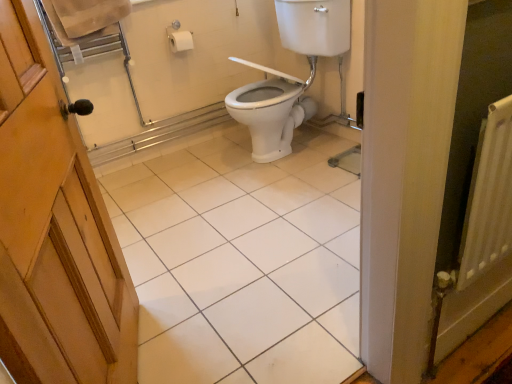
Locate an element on the screen. white glossy toilet at center is located at coordinates tap(290, 75).

What is the approximate height of white glossy toilet at center?

37.06 inches.

Describe the element at coordinates (290, 75) in the screenshot. I see `white glossy toilet at center` at that location.

Where is `white glossy tile at center`? This screenshot has width=512, height=384. white glossy tile at center is located at coordinates (240, 259).

This screenshot has width=512, height=384. Describe the element at coordinates (240, 259) in the screenshot. I see `white glossy tile at center` at that location.

Where is `white glossy toilet at center`? The width and height of the screenshot is (512, 384). white glossy toilet at center is located at coordinates (290, 75).

Considering the relative positions of white glossy toilet at center and white glossy tile at center in the image provided, is white glossy toilet at center to the left or to the right of white glossy tile at center?

Based on their positions, white glossy toilet at center is located to the right of white glossy tile at center.

Is white glossy toilet at center further to camera compared to white glossy tile at center?

Yes, white glossy toilet at center is behind white glossy tile at center.

Is point (272, 138) positioned behind point (300, 135)?

No, it is not.

From the image's perspective, is white glossy toilet at center located beneath white glossy tile at center?

Incorrect, from the image's perspective, white glossy toilet at center is higher than white glossy tile at center.

From a real-world perspective, between white glossy toilet at center and white glossy tile at center, who is vertically lower?

white glossy tile at center.

Considering the sizes of objects white glossy toilet at center and white glossy tile at center in the image provided, who is thinner, white glossy toilet at center or white glossy tile at center?

white glossy toilet at center.

Is white glossy toilet at center taller than white glossy tile at center?

Correct, white glossy toilet at center is much taller as white glossy tile at center.

Considering the sizes of objects white glossy toilet at center and white glossy tile at center in the image provided, who is bigger, white glossy toilet at center or white glossy tile at center?

white glossy toilet at center is bigger.

Is white glossy toilet at center located outside white glossy tile at center?

Indeed, white glossy toilet at center is completely outside white glossy tile at center.

Is white glossy toilet at center far from white glossy tile at center?

No, there isn't a large distance between white glossy toilet at center and white glossy tile at center.

Is white glossy toilet at center looking in the opposite direction of white glossy tile at center?

No, white glossy tile at center is not at the back of white glossy toilet at center.

How many degrees apart are the facing directions of white glossy toilet at center and white glossy tile at center?

They differ by 88.7 degrees in their facing directions.

Where is `tile on the left side of white glossy toilet at center`? tile on the left side of white glossy toilet at center is located at coordinates (240, 259).

Can you confirm if white glossy tile at center is positioned to the left of white glossy toilet at center?

Correct, you'll find white glossy tile at center to the left of white glossy toilet at center.

Which is behind, white glossy tile at center or white glossy toilet at center?

white glossy toilet at center is further away from the camera.

Is point (167, 219) closer or farther from the camera than point (301, 42)?

Clearly, point (167, 219) is closer to the camera than point (301, 42).

From the image's perspective, is white glossy tile at center located above or below white glossy toilet at center?

Clearly, from the image's perspective, white glossy tile at center is below white glossy toilet at center.

From a real-world perspective, which is physically above, white glossy tile at center or white glossy toilet at center?

white glossy toilet at center is physically above.

Is white glossy tile at center thinner than white glossy toilet at center?

No, white glossy tile at center is not thinner than white glossy toilet at center.

Considering the relative sizes of white glossy tile at center and white glossy toilet at center in the image provided, is white glossy tile at center taller than white glossy toilet at center?

No, white glossy tile at center is not taller than white glossy toilet at center.

In terms of size, does white glossy tile at center appear bigger or smaller than white glossy toilet at center?

Clearly, white glossy tile at center is smaller in size than white glossy toilet at center.

Is white glossy tile at center outside of white glossy toilet at center?

white glossy tile at center is positioned outside white glossy toilet at center.

Are white glossy tile at center and white glossy toilet at center located far from each other?

No, white glossy tile at center is not far away from white glossy toilet at center.

Is white glossy tile at center turned away from white glossy toilet at center?

white glossy tile at center does not have its back to white glossy toilet at center.

How many degrees apart are the facing directions of white glossy tile at center and white glossy toilet at center?

The facing directions of white glossy tile at center and white glossy toilet at center are 88.7 degrees apart.

How far apart are white glossy tile at center and white glossy toilet at center?

white glossy tile at center and white glossy toilet at center are 25.52 inches apart.

At what (x,y) coordinates should I click in order to perform the action: click on tile lying in front of the white glossy toilet at center. Please return your answer as a coordinate pair (x, y). This screenshot has height=384, width=512. Looking at the image, I should click on (240, 259).

Where is `sink behind the white glossy tile at center`? sink behind the white glossy tile at center is located at coordinates (290, 75).

You are a GUI agent. You are given a task and a screenshot of the screen. Output one action in this format:
    pyautogui.click(x=<x>, y=<y>)
    Task: Click on the tile on the left of white glossy toilet at center
    
    Given the screenshot: What is the action you would take?
    pyautogui.click(x=240, y=259)